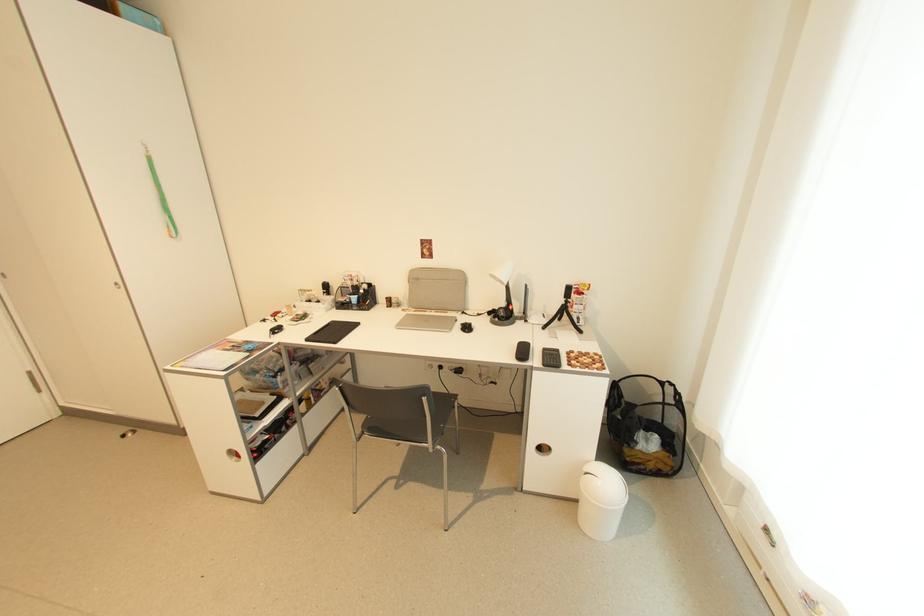
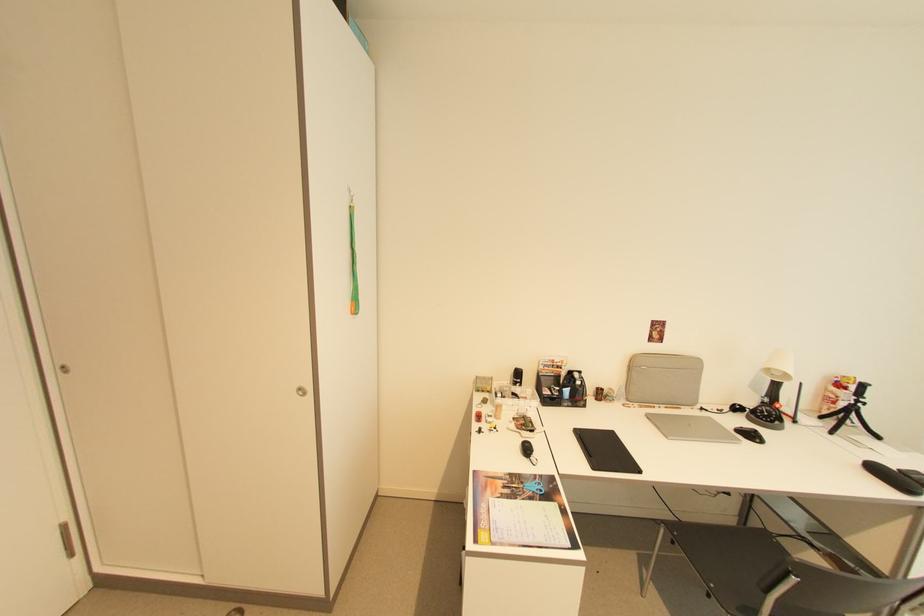
Locate, in the second image, the point that corresponds to [237,346] in the first image.

(505, 484)